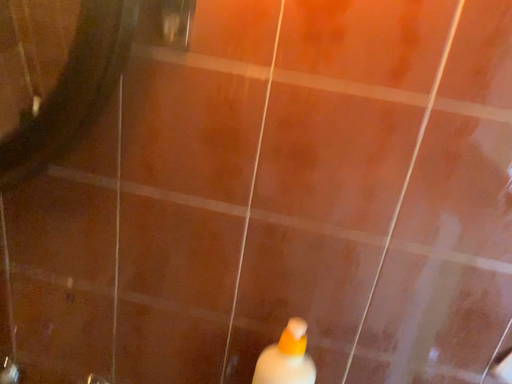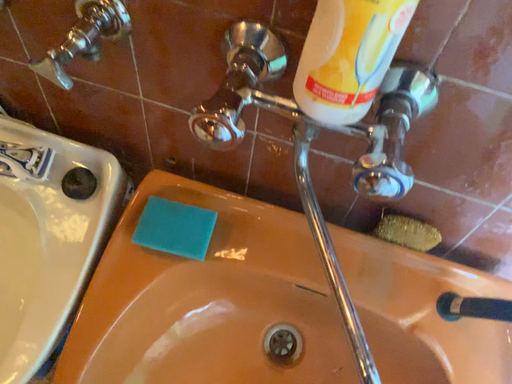
Question: Which way did the camera rotate in the video?

Choices:
 (A) rotated upward
 (B) rotated downward

Answer: (B)